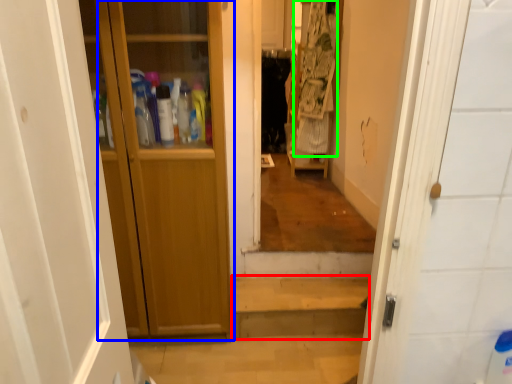
Question: Based on their relative distances, which object is nearer to stairwell (highlighted by a red box)? Choose from door (highlighted by a blue box) and laundry (highlighted by a green box).

Choices:
 (A) door
 (B) laundry

Answer: (A)